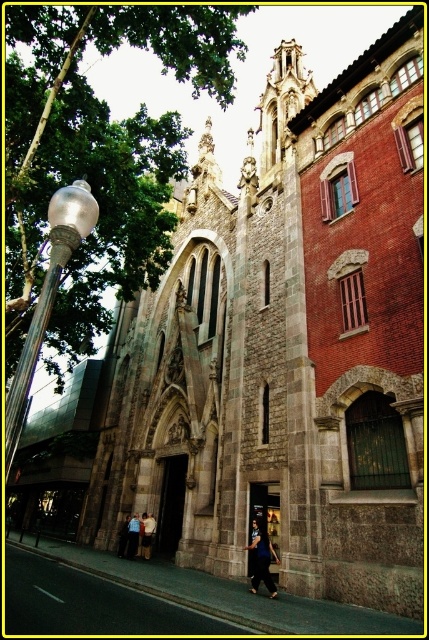
Question: Which point is farther from the camera taking this photo?

Choices:
 (A) (132, 556)
 (B) (150, 552)
 (C) (75, 225)

Answer: (B)

Question: Does light blue shirt at center have a smaller size compared to light blue denim pants at lower center?

Choices:
 (A) no
 (B) yes

Answer: (B)

Question: Is satin silver pole at left smaller than light blue shirt at center?

Choices:
 (A) yes
 (B) no

Answer: (B)

Question: Among these objects, which one is farthest from the camera?

Choices:
 (A) light blue shirt at center
 (B) light blue denim pants at lower center

Answer: (A)

Question: Can you confirm if satin silver pole at left is positioned to the right of dark blue fabric dress at center?

Choices:
 (A) yes
 (B) no

Answer: (B)

Question: Which object appears closest to the camera in this image?

Choices:
 (A) light blue denim pants at lower center
 (B) dark blue fabric dress at center
 (C) light blue shirt at center
 (D) satin silver pole at left

Answer: (D)